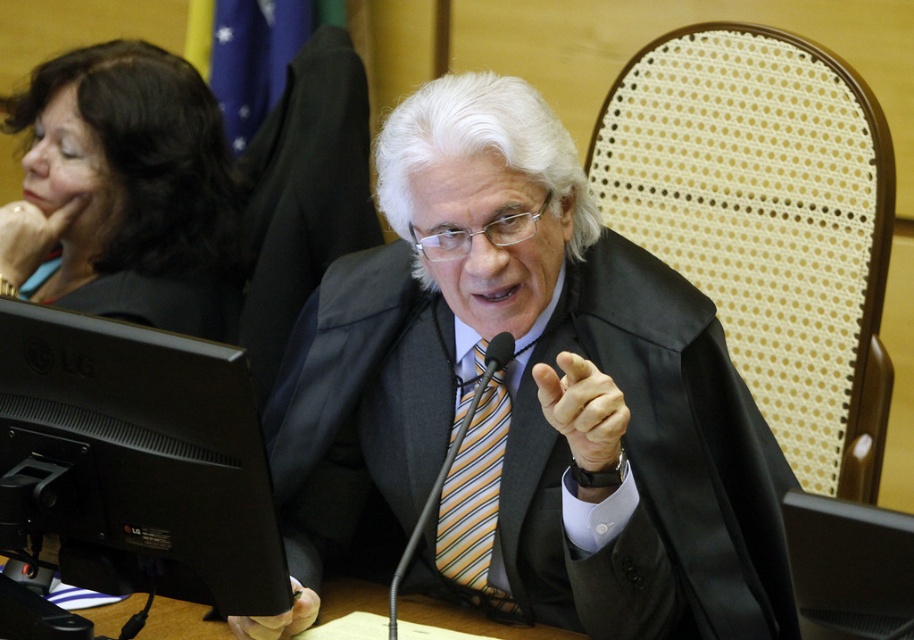
Which is above, black fabric at upper left or gold metallic ring at upper left?

black fabric at upper left

Who is more forward, (133, 58) or (27, 204)?

Point (27, 204)

Image resolution: width=914 pixels, height=640 pixels. Find the location of `black fabric at upper left`. black fabric at upper left is located at coordinates (133, 186).

Is point (200, 356) less distant than point (29, 269)?

Yes, point (200, 356) is closer to viewer.

Can you confirm if black matte monitor at lower left is thinner than gold metallic ring at upper left?

Incorrect, black matte monitor at lower left's width is not less than gold metallic ring at upper left's.

Who is more distant from viewer, (263, 550) or (29, 268)?

The point (29, 268) is more distant.

Identify the location of black matte monitor at lower left. (135, 456).

Is smooth skin hand at center above matte black hand at lower center?

Yes, smooth skin hand at center is above matte black hand at lower center.

At what (x,y) coordinates should I click in order to perform the action: click on smooth skin hand at center. Please return your answer as a coordinate pair (x, y). The height and width of the screenshot is (640, 914). Looking at the image, I should click on (582, 410).

Where is `smooth skin hand at center`? Image resolution: width=914 pixels, height=640 pixels. smooth skin hand at center is located at coordinates (582, 410).